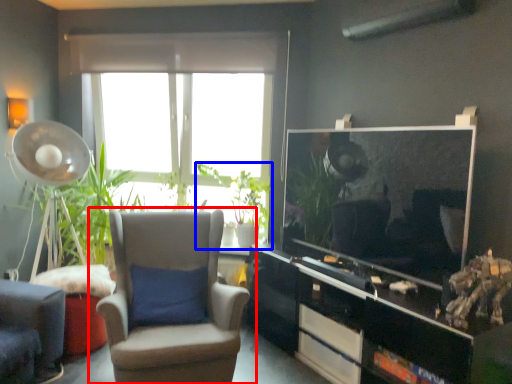
Question: Which object is closer to the camera taking this photo, chair (highlighted by a red box) or houseplant (highlighted by a blue box)?

Choices:
 (A) chair
 (B) houseplant

Answer: (A)